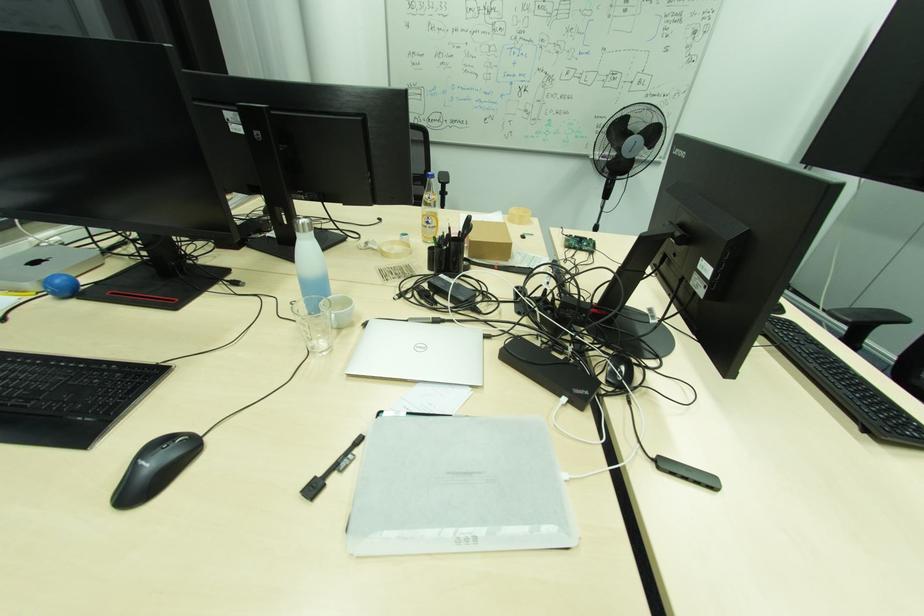
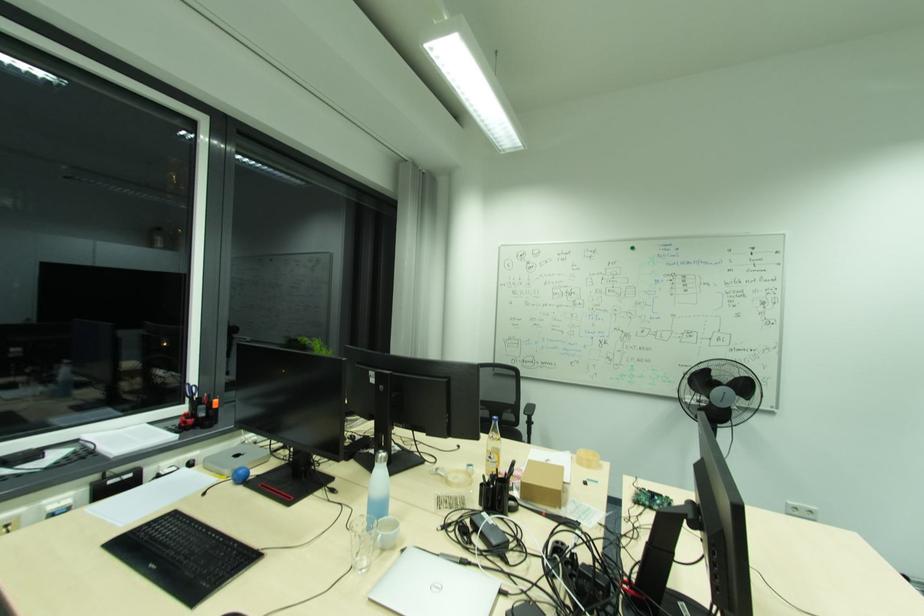
Where in the second image is the point corresponding to point 336,317 from the first image?

(383, 537)